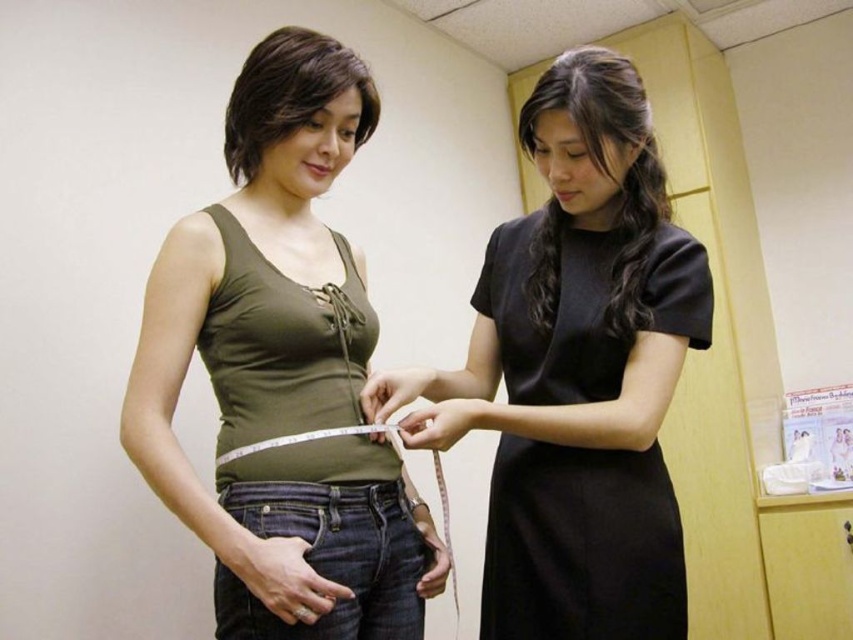
Based on the photo, is matte green tank top at center shorter than black satin dress at center?

No, matte green tank top at center is not shorter than black satin dress at center.

Is matte green tank top at center below black satin dress at center?

Actually, matte green tank top at center is above black satin dress at center.

Is point (265, 586) positioned before point (497, 570)?

Yes, point (265, 586) is closer to viewer.

The height and width of the screenshot is (640, 853). What are the coordinates of `matte green tank top at center` in the screenshot? It's located at (282, 371).

Who is lower down, matte green tank top at center or black satin dress at upper right?

black satin dress at upper right is below.

Is point (198, 336) closer to camera compared to point (567, 509)?

That is True.

Where is `matte green tank top at center`? This screenshot has width=853, height=640. matte green tank top at center is located at coordinates (282, 371).

Is black satin dress at center taller than black satin dress at upper right?

Yes.

Who is more forward, [508,420] or [590,250]?

Point [508,420] is more forward.

Identify the location of black satin dress at center. (576, 372).